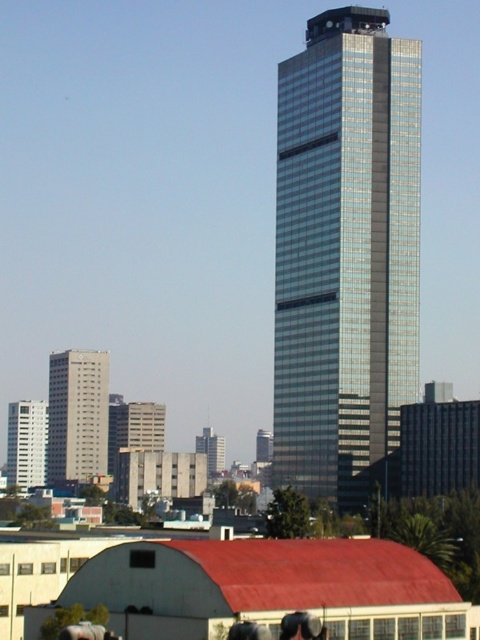
Question: Which point is closer to the camera taking this photo?

Choices:
 (A) (26, 404)
 (B) (85, 378)
 (C) (295, 628)
 (D) (312, 100)

Answer: (C)

Question: Which object is closer to the camera taking this photo?

Choices:
 (A) matte gray building at center
 (B) smooth black hair at lower center
 (C) gray concrete building at left
 (D) glossy glass skyscraper at center

Answer: (B)

Question: Considering the relative positions of white glossy building at left and smooth black hair at lower center in the image provided, where is white glossy building at left located with respect to smooth black hair at lower center?

Choices:
 (A) left
 (B) right

Answer: (A)

Question: Based on their relative distances, which object is nearer to the smooth black hair at lower center?

Choices:
 (A) gray concrete building at left
 (B) glossy glass skyscraper at center
 (C) white glossy building at left
 (D) matte gray building at center

Answer: (B)

Question: Is glossy glass skyscraper at center closer to camera compared to matte gray building at center?

Choices:
 (A) no
 (B) yes

Answer: (B)

Question: Observing the image, what is the correct spatial positioning of gray concrete building at left in reference to matte gray building at center?

Choices:
 (A) below
 (B) above

Answer: (B)